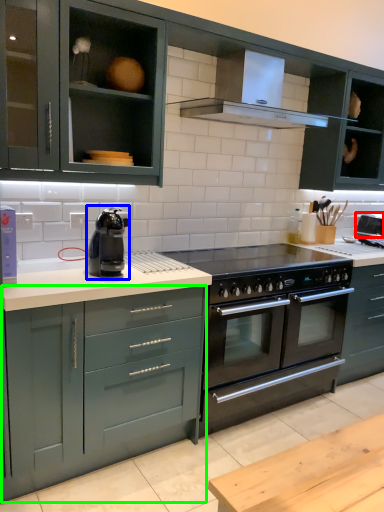
Question: Which object is the closest to the appliance (highlighted by a red box)? Choose among these: home appliance (highlighted by a blue box) or cabinetry (highlighted by a green box).

Choices:
 (A) home appliance
 (B) cabinetry

Answer: (A)